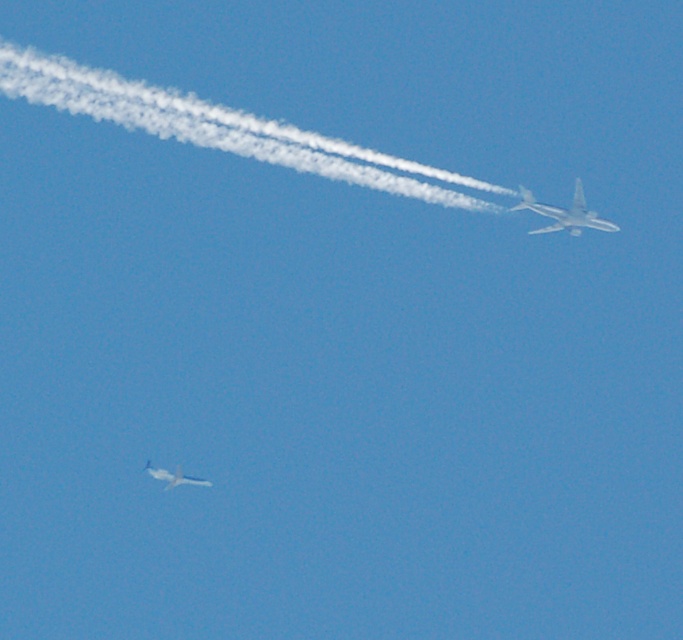
Question: Which is farther from the white vapor trail at upper center?

Choices:
 (A) white glossy airplane at upper right
 (B) metallic silver airplane at lower left

Answer: (B)

Question: Which point is farther from the camera taking this photo?

Choices:
 (A) (223, 138)
 (B) (576, 220)

Answer: (B)

Question: Considering the real-world distances, which object is farthest from the white glossy airplane at upper right?

Choices:
 (A) white vapor trail at upper center
 (B) metallic silver airplane at lower left

Answer: (B)

Question: Can you confirm if white vapor trail at upper center is positioned to the right of white glossy airplane at upper right?

Choices:
 (A) yes
 (B) no

Answer: (B)

Question: Does white vapor trail at upper center have a lesser width compared to white glossy airplane at upper right?

Choices:
 (A) no
 (B) yes

Answer: (A)

Question: Can you confirm if white vapor trail at upper center is positioned below metallic silver airplane at lower left?

Choices:
 (A) yes
 (B) no

Answer: (B)